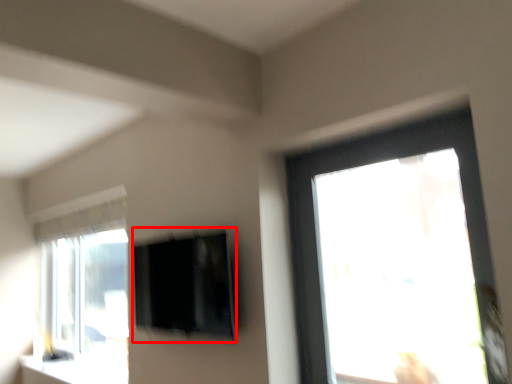
Question: Considering the relative positions of window screen (annotated by the red box) and window sill in the image provided, where is window screen (annotated by the red box) located with respect to the staircase?

Choices:
 (A) right
 (B) left

Answer: (A)